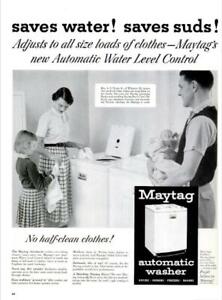
Locate an element on the screen. The width and height of the screenshot is (222, 300). dryer is located at coordinates (125, 185).